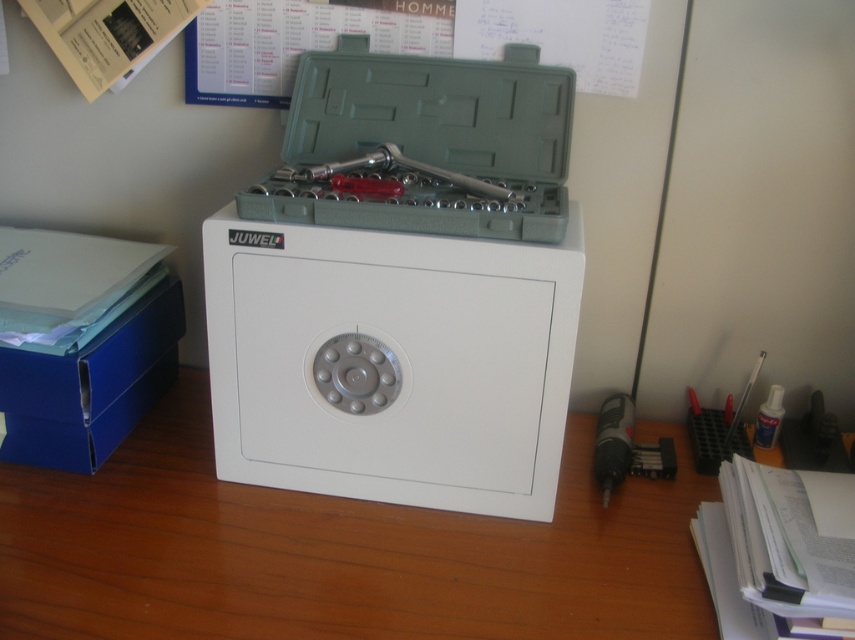
Question: Is white plastic toolbox at center positioned at the back of white wood table at center?

Choices:
 (A) no
 (B) yes

Answer: (B)

Question: Can you confirm if white plastic toolbox at center is bigger than white wood table at center?

Choices:
 (A) no
 (B) yes

Answer: (A)

Question: Which of the following is the farthest from the observer?

Choices:
 (A) (603, 572)
 (B) (133, 314)
 (C) (292, 220)

Answer: (B)

Question: Estimate the real-world distances between objects in this image. Which object is farther from the white wood table at center?

Choices:
 (A) blue cardboard box at left
 (B) white plastic toolbox at center

Answer: (B)

Question: Which point is farther from the camera taking this photo?

Choices:
 (A) (27, 445)
 (B) (127, 452)

Answer: (B)

Question: Does white plastic toolbox at center appear on the left side of white wood table at center?

Choices:
 (A) yes
 (B) no

Answer: (B)